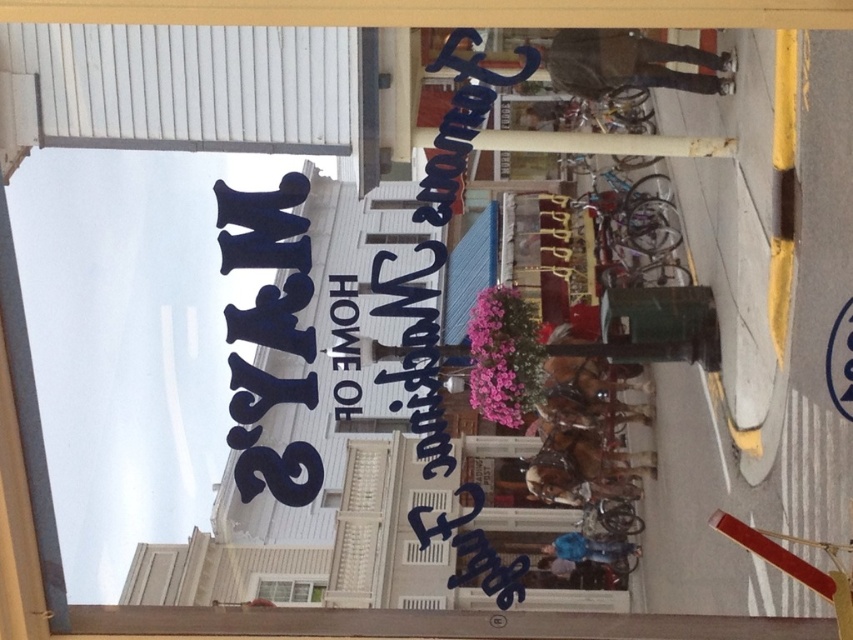
Is blue painted sign at upper left behind white paper sign at upper center?

That is False.

Between point (91, 278) and point (402, 308), which one is positioned in front?

Positioned in front is point (402, 308).

Image resolution: width=853 pixels, height=640 pixels. Find the location of `blue painted sign at upper left`. blue painted sign at upper left is located at coordinates (129, 340).

Can you confirm if blue painted sign at upper left is thinner than white matte window at lower center?

Incorrect, blue painted sign at upper left's width is not less than white matte window at lower center's.

Does blue painted sign at upper left appear on the right side of white matte window at lower center?

Incorrect, blue painted sign at upper left is not on the right side of white matte window at lower center.

Does point (148, 262) lie behind point (260, 593)?

That is False.

At what (x,y) coordinates should I click in order to perform the action: click on blue painted sign at upper left. Please return your answer as a coordinate pair (x, y). Looking at the image, I should click on pos(129,340).

Which is above, white paper sign at upper center or white matte window at lower center?

white paper sign at upper center is above.

Is white paper sign at upper center wider than white matte window at lower center?

Indeed, white paper sign at upper center has a greater width compared to white matte window at lower center.

Does point (372, 269) lie in front of point (273, 589)?

Yes.

Locate an element on the screen. This screenshot has width=853, height=640. white paper sign at upper center is located at coordinates (410, 353).